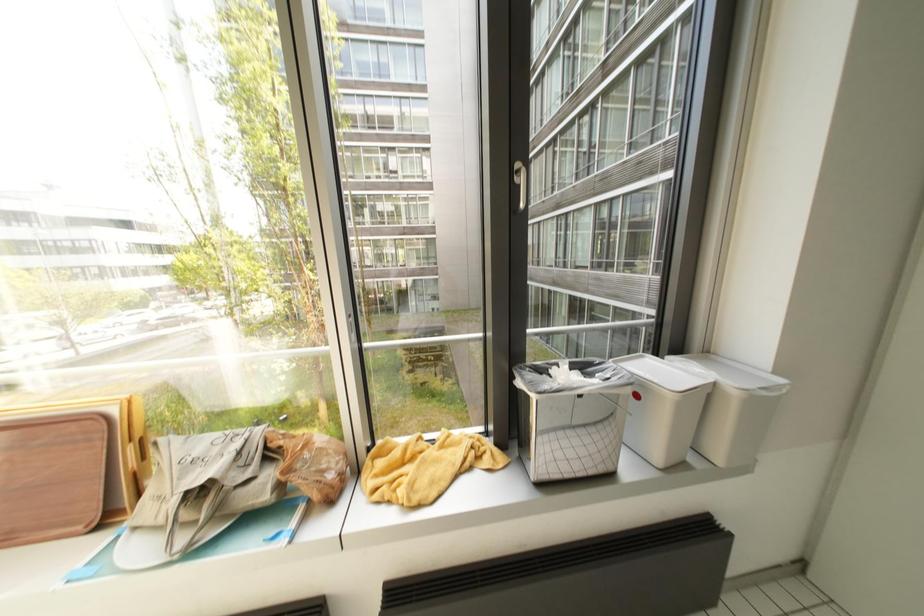
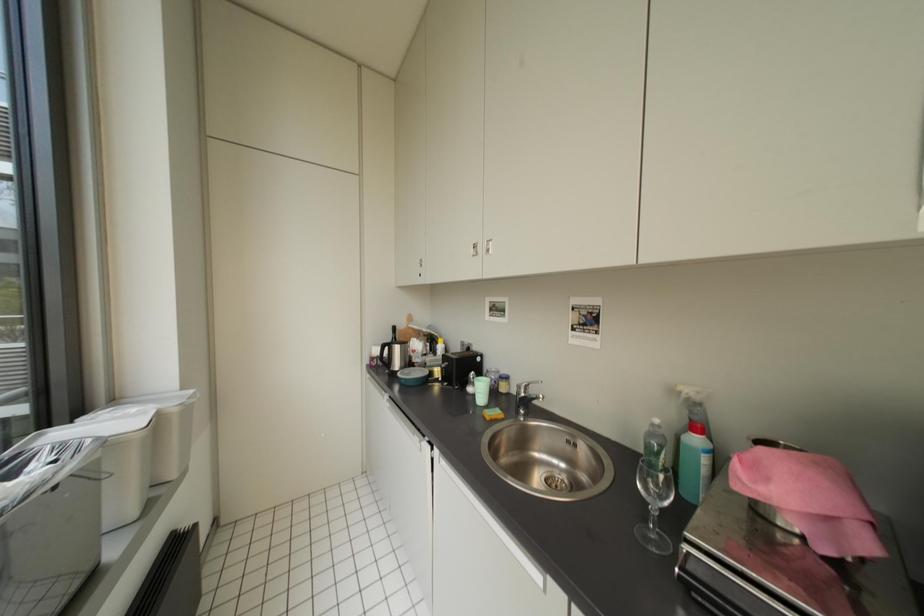
Question: The camera is either moving clockwise (left) or counter-clockwise (right) around the object. The first image is from the beginning of the video and the second image is from the end. Is the camera moving left or right when shooting the video?

Choices:
 (A) Left
 (B) Right

Answer: (A)